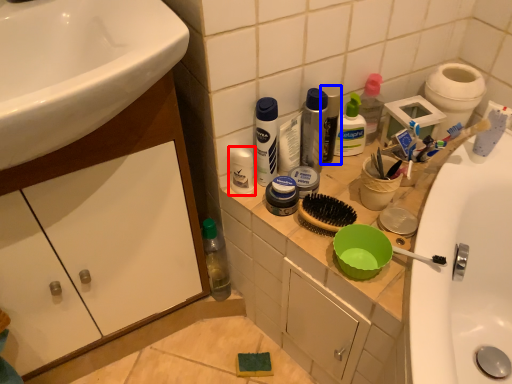
Question: Which object appears closest to the camera in this image, toiletry (highlighted by a red box) or mouthwash (highlighted by a blue box)?

Choices:
 (A) toiletry
 (B) mouthwash

Answer: (A)